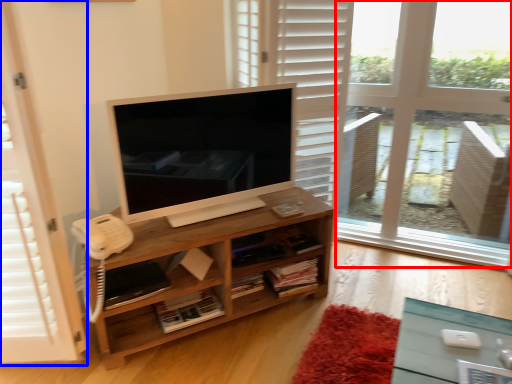
Question: Which of the following is the farthest to the observer, window frame (highlighted by a red box) or screen door (highlighted by a blue box)?

Choices:
 (A) window frame
 (B) screen door

Answer: (A)